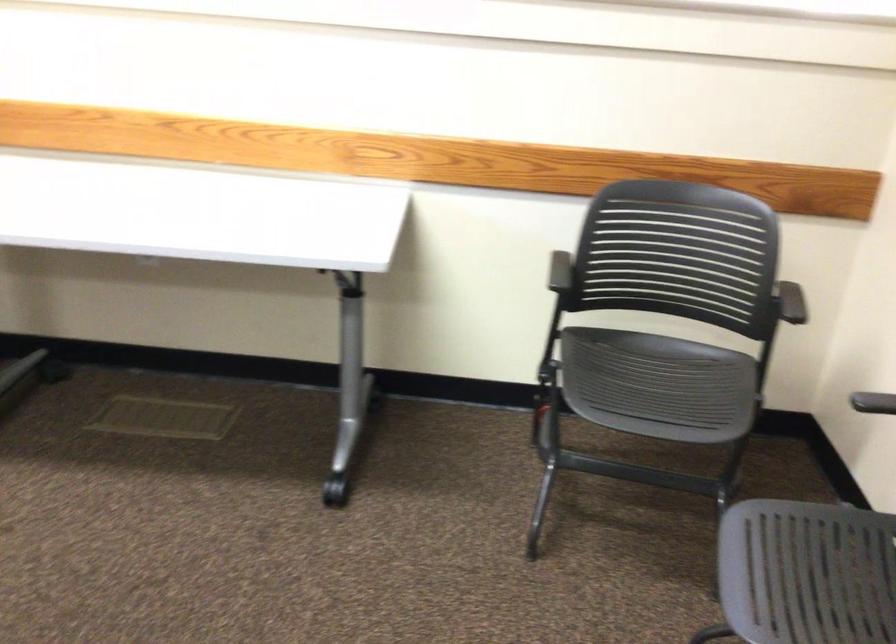
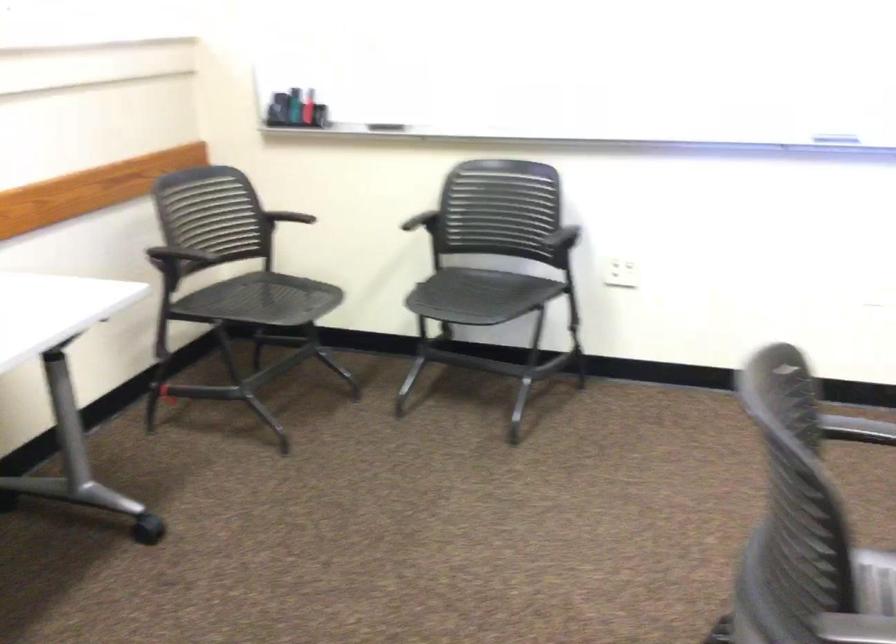
In the second image, find the point that corresponds to the point at 790,301 in the first image.

(308, 212)